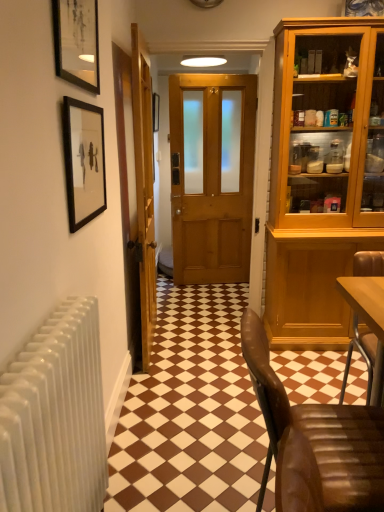
Find the location of a particular element. The image size is (384, 512). free spot below wooden door at center, positioned as the 2th door in left-to-right order (from a real-world perspective) is located at coordinates (207, 317).